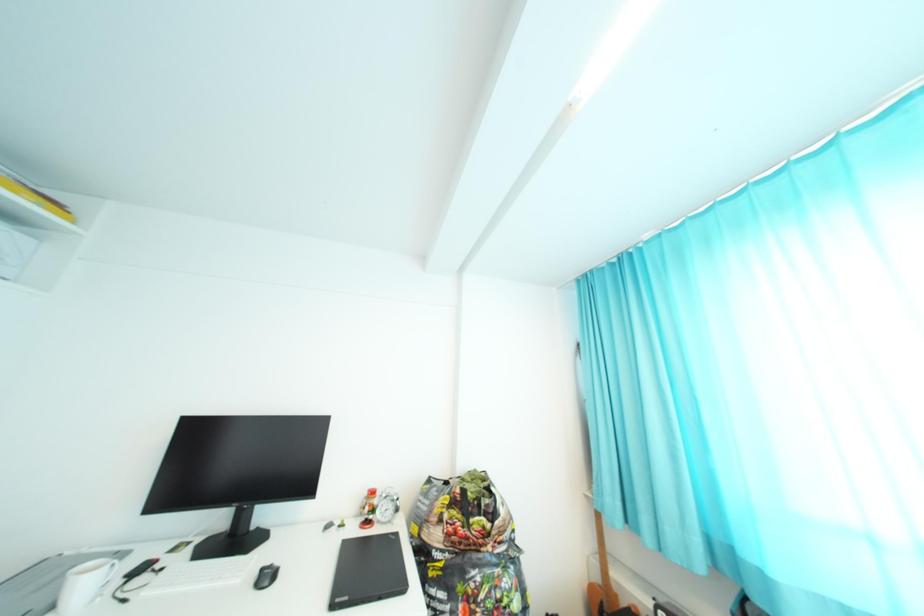
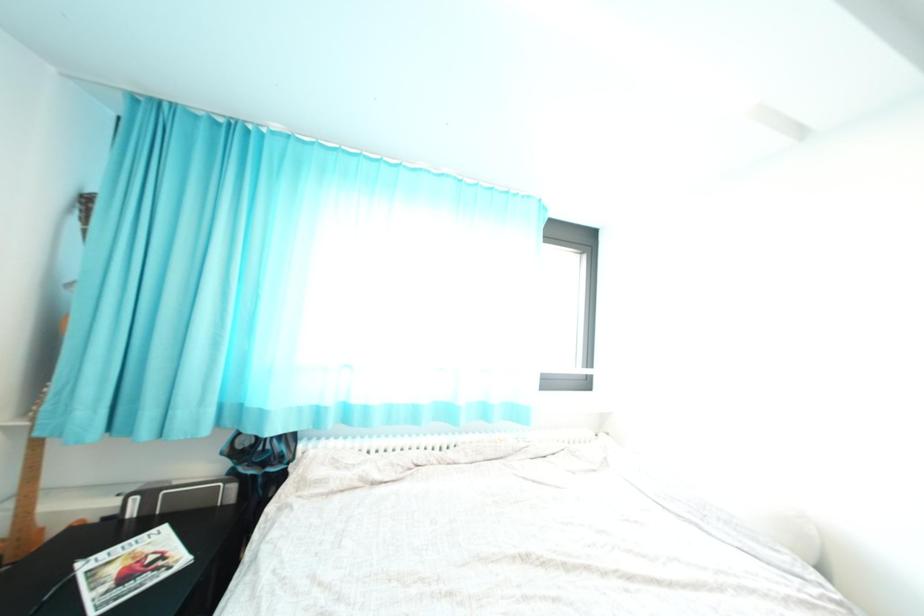
Question: The images are taken continuously from a first-person perspective. In which direction is your viewpoint rotating?

Choices:
 (A) Left
 (B) Right
 (C) Up
 (D) Down

Answer: (B)